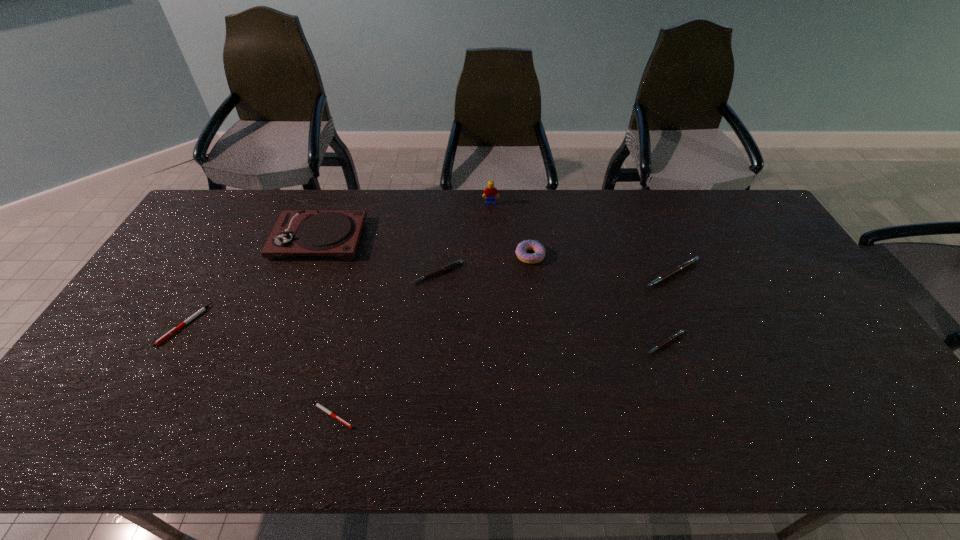
The height and width of the screenshot is (540, 960). What are the coordinates of `the farther white pen` in the screenshot? It's located at (168, 334).

This screenshot has height=540, width=960. Identify the location of the left white pen. (168, 334).

Find the location of `the shortest pen`. the shortest pen is located at coordinates (318, 405).

At what (x,y) coordinates should I click in order to perform the action: click on the nearer white pen. Please return your answer as a coordinate pair (x, y). The image size is (960, 540). Looking at the image, I should click on (318, 405).

Identify the location of free space located on the face of the farthest object. Image resolution: width=960 pixels, height=540 pixels. (492, 232).

Identify the location of vacant space located 0.340m on the front of the phonograph_record. The width and height of the screenshot is (960, 540). (276, 351).

This screenshot has height=540, width=960. In order to click on vacant space situated on the left of the purple doughnut in this screenshot , I will do `click(434, 255)`.

Identify the location of vacant space located at the nib of the tallest pen. (693, 323).

Find the location of `vacant space located 0.300m at the nib of the second biggest pink pen`. vacant space located 0.300m at the nib of the second biggest pink pen is located at coordinates (428, 372).

Identify the location of vacant point located at the nib of the smallest pink pen. (688, 408).